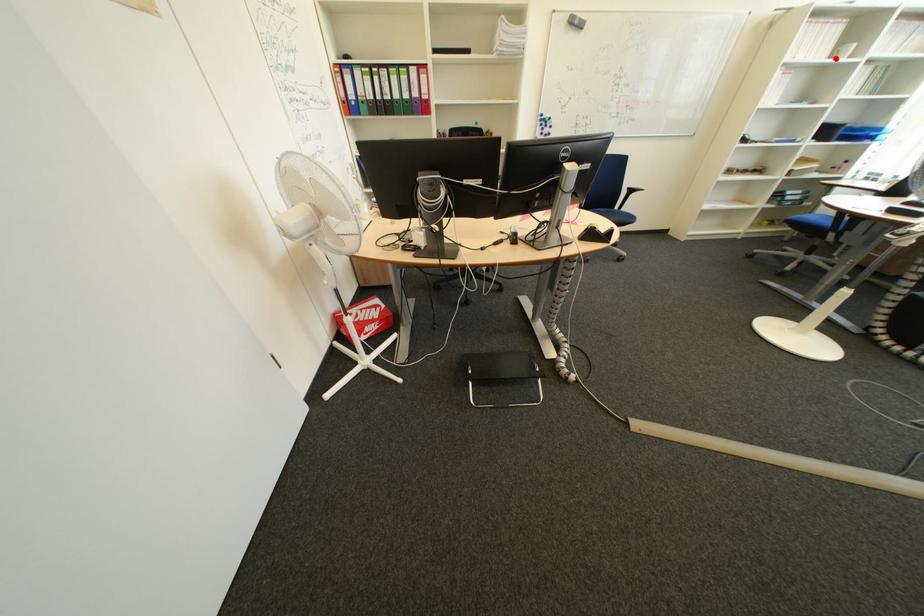
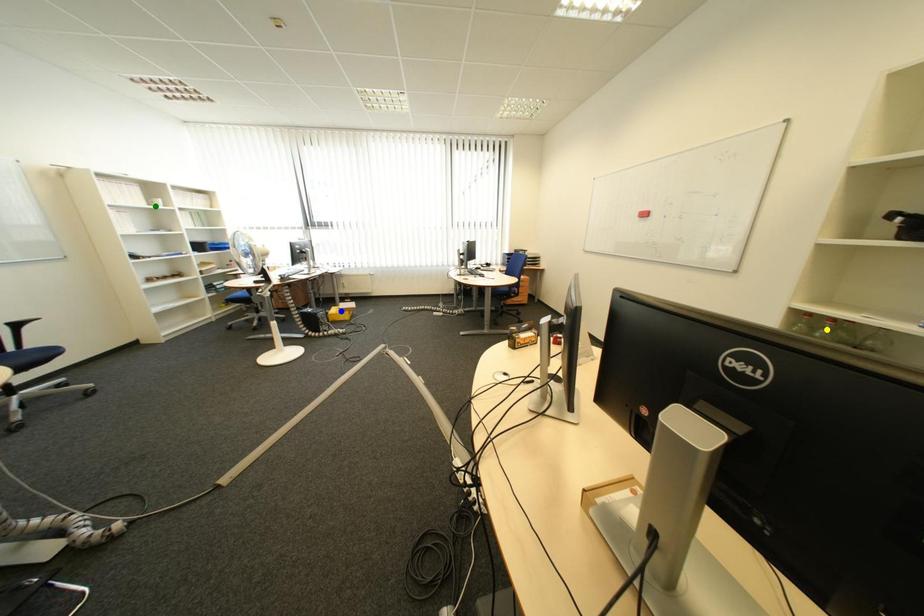
Question: I am providing you with two images of the same scene from different viewpoints. A red point is marked on the first image. You are given multiple points on the second image. Which point in image 2 is actually the same real-world point as the red point in image 1?

Choices:
 (A) yellow point
 (B) blue point
 (C) green point

Answer: (C)